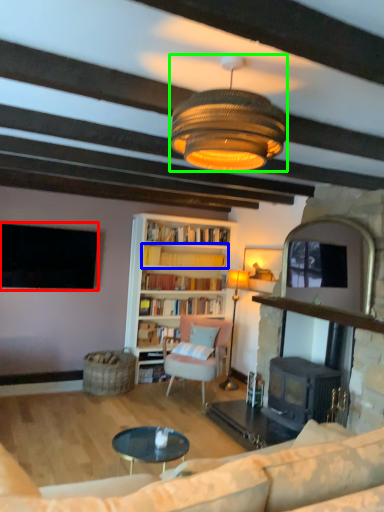
Question: Which is farther away from television (highlighted by a red box)? book (highlighted by a blue box) or lamp (highlighted by a green box)?

Choices:
 (A) book
 (B) lamp

Answer: (B)